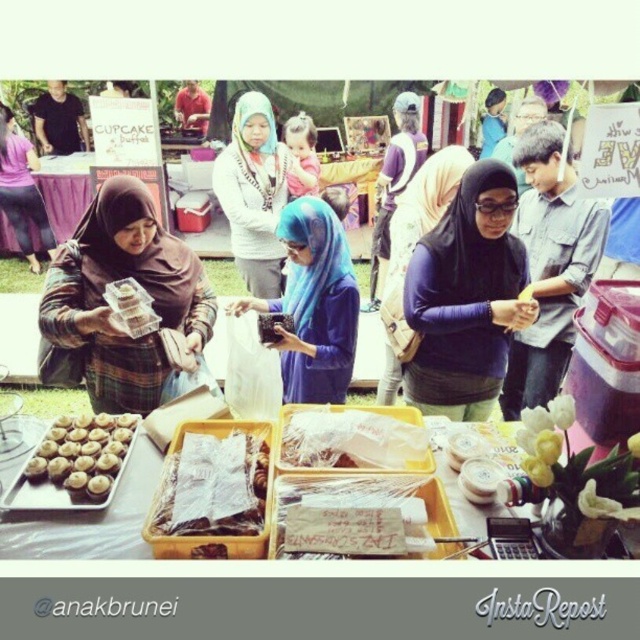
Question: Does purple matte hijab at center lie in front of matte black hijab at center?

Choices:
 (A) no
 (B) yes

Answer: (B)

Question: In this image, where is matte brown hijab at center located relative to matte black hijab at center?

Choices:
 (A) right
 (B) left

Answer: (B)

Question: Which object appears farthest from the camera in this image?

Choices:
 (A) translucent plastic bag at center
 (B) matte brown hijab at center
 (C) matte brown hijab at upper left

Answer: (C)

Question: Which point is farther from the camera taking this photo?

Choices:
 (A) (436, 326)
 (B) (4, 170)
 (C) (129, 554)
 (D) (67, 480)

Answer: (B)

Question: Which point appears closest to the camera in this image?

Choices:
 (A) (440, 193)
 (B) (93, 476)

Answer: (B)

Question: Is purple matte hijab at center in front of blue fabric headscarf at center?

Choices:
 (A) yes
 (B) no

Answer: (A)